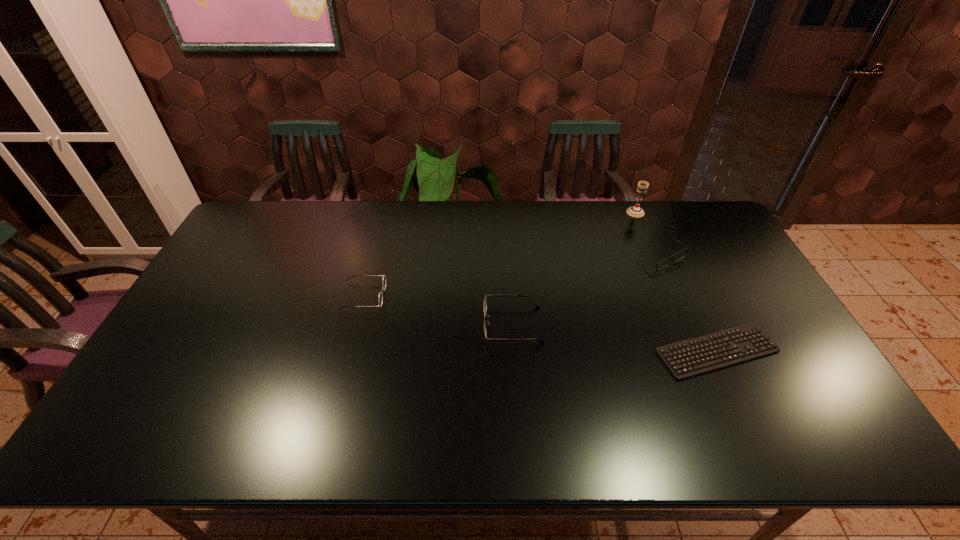
At what (x,y) coordinates should I click in order to perform the action: click on vacant space that's between the farthest object and the leftmost object. Please return your answer as a coordinate pair (x, y). Looking at the image, I should click on (499, 254).

Where is `vacant space that is in between the second farthest object and the leftmost object`? Image resolution: width=960 pixels, height=540 pixels. vacant space that is in between the second farthest object and the leftmost object is located at coordinates (512, 277).

You are a GUI agent. You are given a task and a screenshot of the screen. Output one action in this format:
    pyautogui.click(x=<x>, y=<y>)
    Task: Click on the free space that is in between the leftmost spectacles and the second spectacles from right to left
    This screenshot has width=960, height=540.
    Given the screenshot: What is the action you would take?
    [x=438, y=310]

Find the location of `object that ranks as the fourth closest to the farthest object`. object that ranks as the fourth closest to the farthest object is located at coordinates (384, 277).

Where is `object that stands as the closest to the rightmost spectacles`? Image resolution: width=960 pixels, height=540 pixels. object that stands as the closest to the rightmost spectacles is located at coordinates (635, 211).

Where is `spectacles that is the second closest to the leftmost spectacles`? spectacles that is the second closest to the leftmost spectacles is located at coordinates (681, 254).

Where is `spectacles that is the third closest to the farthest object`? The height and width of the screenshot is (540, 960). spectacles that is the third closest to the farthest object is located at coordinates (384, 277).

Image resolution: width=960 pixels, height=540 pixels. I want to click on free space that satisfies the following two spatial constraints: 1. with the lenses facing outward on the fourth nearest object; 2. on the front-facing side of the leftmost object, so click(678, 296).

At what (x,y) coordinates should I click in order to perform the action: click on free location that satisfies the following two spatial constraints: 1. on the front-facing side of the second spectacles from left to right; 2. on the back side of the computer keyboard. Please return your answer as a coordinate pair (x, y). Image resolution: width=960 pixels, height=540 pixels. Looking at the image, I should click on (515, 351).

Where is `free location that satisfies the following two spatial constraints: 1. with the lenses facing outward on the farthest spectacles; 2. on the front-facing side of the shortest spectacles`? free location that satisfies the following two spatial constraints: 1. with the lenses facing outward on the farthest spectacles; 2. on the front-facing side of the shortest spectacles is located at coordinates (690, 325).